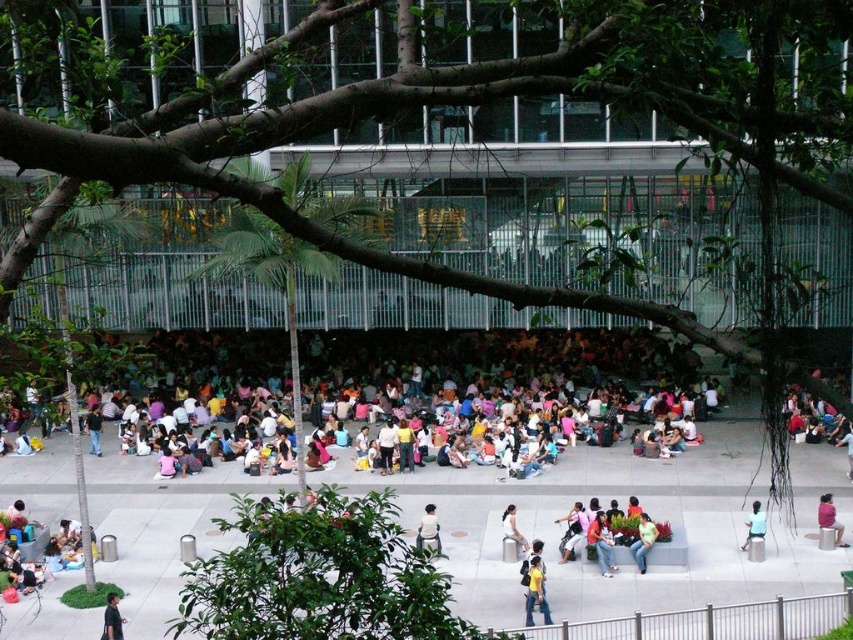
Question: Which is nearer to the pink fabric person at lower right?

Choices:
 (A) denim jacket at center
 (B) blue fabric shirt at lower right
 (C) yellow cotton shirt at center
 (D) green leafy tree at center

Answer: (B)

Question: Which of these objects is positioned closest to the denim jacket at center?

Choices:
 (A) yellow cotton shirt at center
 (B) green fabric person at lower right

Answer: (B)

Question: Does denim jacket at center appear on the right side of blue fabric shirt at lower right?

Choices:
 (A) yes
 (B) no

Answer: (B)

Question: Which point is farther to the camera?

Choices:
 (A) (596, 556)
 (B) (828, 506)
 (C) (759, 508)
 (D) (643, 538)

Answer: (C)

Question: Does green fabric person at lower right appear on the left side of pink fabric person at lower right?

Choices:
 (A) no
 (B) yes

Answer: (B)

Question: Is dark gray shirt at lower left below light brown leather jacket at center?

Choices:
 (A) no
 (B) yes

Answer: (B)